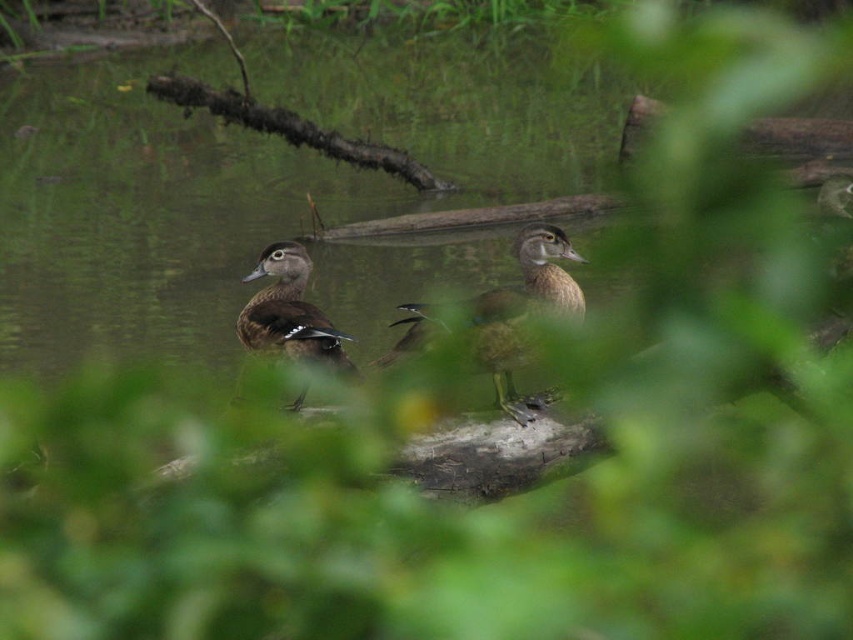
You are a wildlife photographer aiming to capture a closeup shot of both the brown glossy duck at center and the brown matte duck at center. Given their sizes, which duck should you focus on first to ensure you can frame both in the shot?

The brown glossy duck at center is larger, so you should focus on the brown glossy duck at center first to account for its size, then adjust the framing to include the smaller brown matte duck at center.

You are a birdwatcher observing two ducks on a log. You notice a brown glossy duck at center and a brown matte duck at center. Which duck is located to the right of the other?

The brown glossy duck at center is positioned on the right side of the brown matte duck at center.